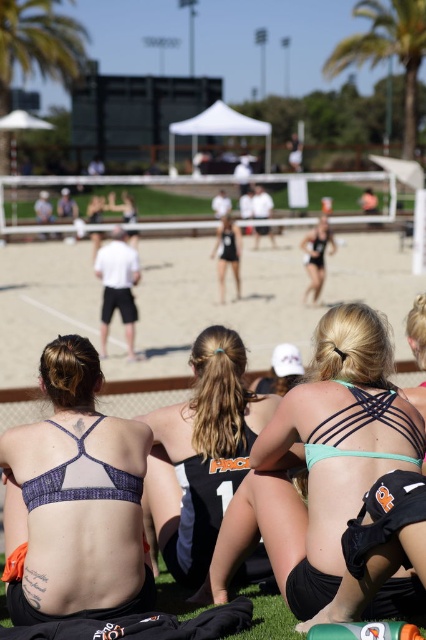
Looking at this image, does sandy beach at center appear under black mesh tank top at center?

Yes, sandy beach at center is below black mesh tank top at center.

Consider the image. Can you confirm if sandy beach at center is smaller than black mesh tank top at center?

No, sandy beach at center is not smaller than black mesh tank top at center.

Is point (299, 340) farther from viewer compared to point (218, 269)?

No, it is not.

Image resolution: width=426 pixels, height=640 pixels. I want to click on sandy beach at center, so 256,298.

Is point (161, 472) behind point (405, 10)?

No, it is in front of (405, 10).

Who is higher up, matte black bikini top at center or green leafy palm tree at upper center?

green leafy palm tree at upper center is above.

At what (x,y) coordinates should I click in order to perform the action: click on matte black bikini top at center. Please return your answer as a coordinate pair (x, y). The width and height of the screenshot is (426, 640). Looking at the image, I should click on (201, 454).

Which of these two, matte black bikini top at center or black athletic wear at center, stands shorter?

With less height is matte black bikini top at center.

What do you see at coordinates (201, 454) in the screenshot? The image size is (426, 640). I see `matte black bikini top at center` at bounding box center [201, 454].

Which is in front, point (273, 584) or point (330, 230)?

Point (273, 584)

I want to click on matte black bikini top at center, so click(201, 454).